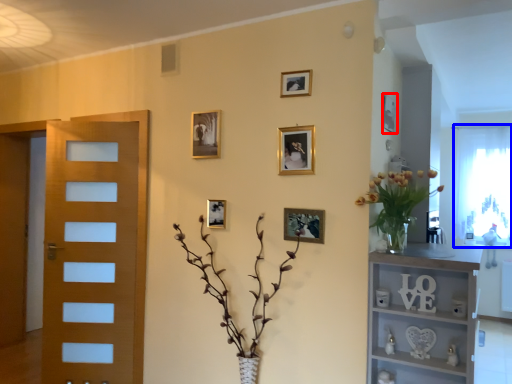
Question: Which point is further to the camera, picture frame (highlighted by a red box) or window screen (highlighted by a blue box)?

Choices:
 (A) picture frame
 (B) window screen

Answer: (B)